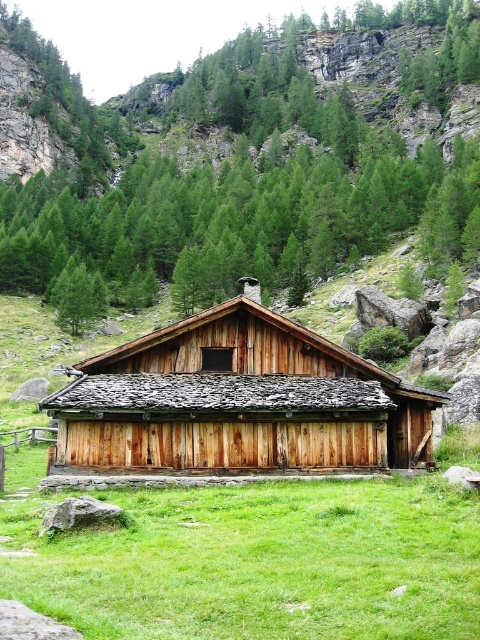
Question: In this image, where is wooden barn at center located relative to green matte tree at center?

Choices:
 (A) left
 (B) right

Answer: (B)

Question: Does wooden barn at center have a lesser width compared to green matte tree at center?

Choices:
 (A) yes
 (B) no

Answer: (B)

Question: Among these objects, which one is farthest from the camera?

Choices:
 (A) green matte tree at center
 (B) green grass at center

Answer: (A)

Question: Which of these objects is positioned closest to the green matte tree at center?

Choices:
 (A) green grass at center
 (B) wooden barn at center

Answer: (B)

Question: Which object is farther from the camera taking this photo?

Choices:
 (A) wooden barn at center
 (B) green matte tree at center

Answer: (B)

Question: Is wooden barn at center thinner than green matte tree at center?

Choices:
 (A) no
 (B) yes

Answer: (A)